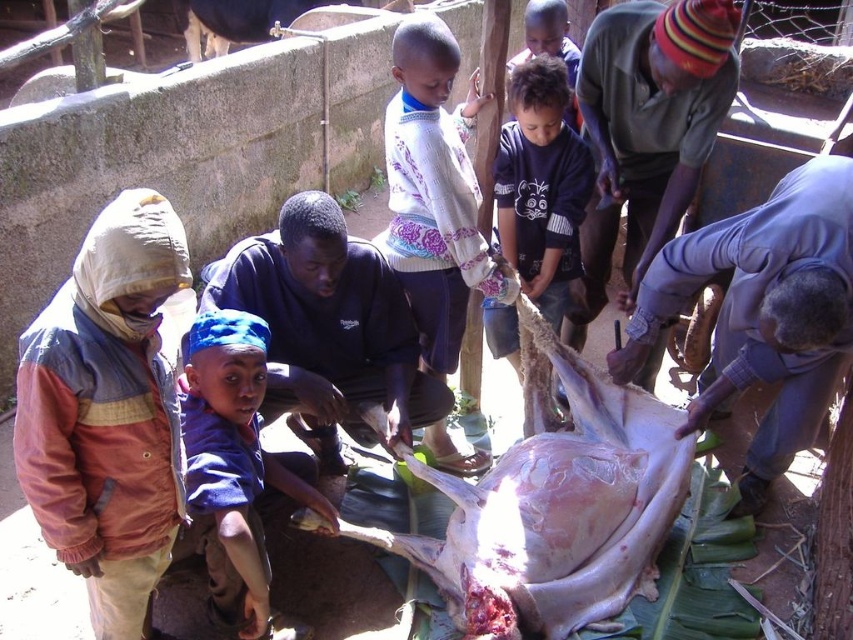
Can you confirm if raw flesh at center is positioned above blue fabric headband at lower left?

Incorrect, raw flesh at center is not positioned above blue fabric headband at lower left.

Which is below, raw flesh at center or blue fabric headband at lower left?

raw flesh at center is below.

The height and width of the screenshot is (640, 853). Find the location of `raw flesh at center`. raw flesh at center is located at coordinates (555, 504).

This screenshot has height=640, width=853. Find the location of `raw flesh at center`. raw flesh at center is located at coordinates (555, 504).

Is point (219, 320) farther from viewer compared to point (508, 323)?

No.

The image size is (853, 640). What do you see at coordinates (233, 458) in the screenshot?
I see `blue fabric headband at lower left` at bounding box center [233, 458].

Where is `blue fabric headband at lower left`? The height and width of the screenshot is (640, 853). blue fabric headband at lower left is located at coordinates (233, 458).

Is raw flesh at center thinner than dark blue cotton shirt at center?

No, raw flesh at center is not thinner than dark blue cotton shirt at center.

In order to click on raw flesh at center in this screenshot , I will do `click(555, 504)`.

Which is behind, point (596, 618) or point (560, 125)?

Point (560, 125)

This screenshot has height=640, width=853. What are the coordinates of `raw flesh at center` in the screenshot? It's located at (555, 504).